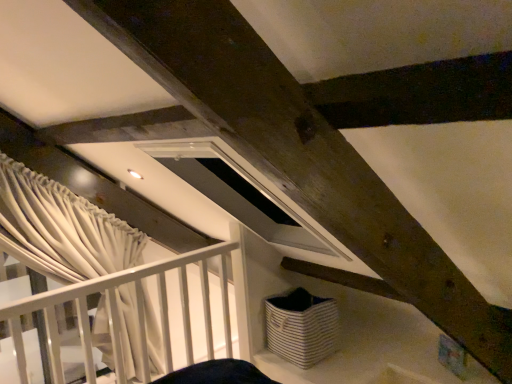
Where is `white matte rail at left`? The width and height of the screenshot is (512, 384). white matte rail at left is located at coordinates (137, 311).

Image resolution: width=512 pixels, height=384 pixels. I want to click on white textured curtain at left, so click(x=61, y=228).

Identify the location of white striped fabric basket at lower center. (302, 327).

Who is smaller, white matte rail at left or white striped fabric basket at lower center?

white striped fabric basket at lower center is smaller.

Would you say white striped fabric basket at lower center is part of white matte rail at left's contents?

Actually, white striped fabric basket at lower center is outside white matte rail at left.

Are white matte rail at left and white striped fabric basket at lower center located far from each other?

No, white matte rail at left is in close proximity to white striped fabric basket at lower center.

In the image, is white matte rail at left on the left side or the right side of white striped fabric basket at lower center?

white matte rail at left is to the left of white striped fabric basket at lower center.

Does white striped fabric basket at lower center touch white textured curtain at left?

No, white striped fabric basket at lower center is not with white textured curtain at left.

Which object is thinner, white striped fabric basket at lower center or white textured curtain at left?

white striped fabric basket at lower center.

From the image's perspective, who appears lower, white striped fabric basket at lower center or white textured curtain at left?

white striped fabric basket at lower center, from the image's perspective.

Is white textured curtain at left turned away from white striped fabric basket at lower center?

No.

From the image's perspective, is white textured curtain at left on top of white striped fabric basket at lower center?

Yes, from the image's perspective, white textured curtain at left is on top of white striped fabric basket at lower center.

In the image, there is a white textured curtain at left. Identify the location of basket below it (from a real-world perspective). Image resolution: width=512 pixels, height=384 pixels. 302,327.

Looking at this image, which point is more forward, [45,262] or [312,329]?

Point [312,329]

Is white matte rail at left positioned with its back to white textured curtain at left?

No, white matte rail at left is not facing away from white textured curtain at left.

From a real-world perspective, is white matte rail at left above or below white textured curtain at left?

From a real-world perspective, white matte rail at left is physically below white textured curtain at left.

Is white matte rail at left in contact with white textured curtain at left?

No, white matte rail at left is not next to white textured curtain at left.

Is white matte rail at left not inside white textured curtain at left?

Absolutely, white matte rail at left is external to white textured curtain at left.

Is white striped fabric basket at lower center facing towards white matte rail at left?

Yes, white striped fabric basket at lower center faces towards white matte rail at left.

Considering the sizes of objects white striped fabric basket at lower center and white matte rail at left in the image provided, who is bigger, white striped fabric basket at lower center or white matte rail at left?

white matte rail at left.

Is white striped fabric basket at lower center to the left or to the right of white matte rail at left in the image?

Based on their positions, white striped fabric basket at lower center is located to the right of white matte rail at left.

From a real-world perspective, is white striped fabric basket at lower center physically below white matte rail at left?

Indeed, from a real-world perspective, white striped fabric basket at lower center is positioned beneath white matte rail at left.

Considering the sizes of objects white textured curtain at left and white matte rail at left in the image provided, who is shorter, white textured curtain at left or white matte rail at left?

With less height is white textured curtain at left.

Looking at this image, considering the sizes of white textured curtain at left and white matte rail at left in the image, is white textured curtain at left bigger or smaller than white matte rail at left?

In the image, white textured curtain at left appears to be smaller than white matte rail at left.

Is white textured curtain at left facing away from white matte rail at left?

white textured curtain at left does not have its back to white matte rail at left.

Is white textured curtain at left at the left side of white matte rail at left?

Yes.

Find the location of a particular element. The width and height of the screenshot is (512, 384). basket below the white matte rail at left (from the image's perspective) is located at coordinates (302, 327).

Identify the location of curtain on the left of white striped fabric basket at lower center. (61, 228).

Which object lies nearer to the anchor point white striped fabric basket at lower center, white textured curtain at left or white matte rail at left?

Among the two, white matte rail at left is located nearer to white striped fabric basket at lower center.

Estimate the real-world distances between objects in this image. Which object is closer to white matte rail at left, white textured curtain at left or white striped fabric basket at lower center?

Among the two, white textured curtain at left is located nearer to white matte rail at left.

Considering their positions, is white matte rail at left positioned further to white striped fabric basket at lower center than white textured curtain at left?

Based on the image, white textured curtain at left appears to be further to white striped fabric basket at lower center.

From the image, which object appears to be nearer to white textured curtain at left, white striped fabric basket at lower center or white matte rail at left?

Among the two, white matte rail at left is located nearer to white textured curtain at left.

Estimate the real-world distances between objects in this image. Which object is further from white matte rail at left, white striped fabric basket at lower center or white textured curtain at left?

Result: Among the two, white striped fabric basket at lower center is located further to white matte rail at left.

Looking at the image, which one is located further to white textured curtain at left, white matte rail at left or white striped fabric basket at lower center?

Based on the image, white striped fabric basket at lower center appears to be further to white textured curtain at left.

Identify the location of rail between white textured curtain at left and white striped fabric basket at lower center. (137, 311).